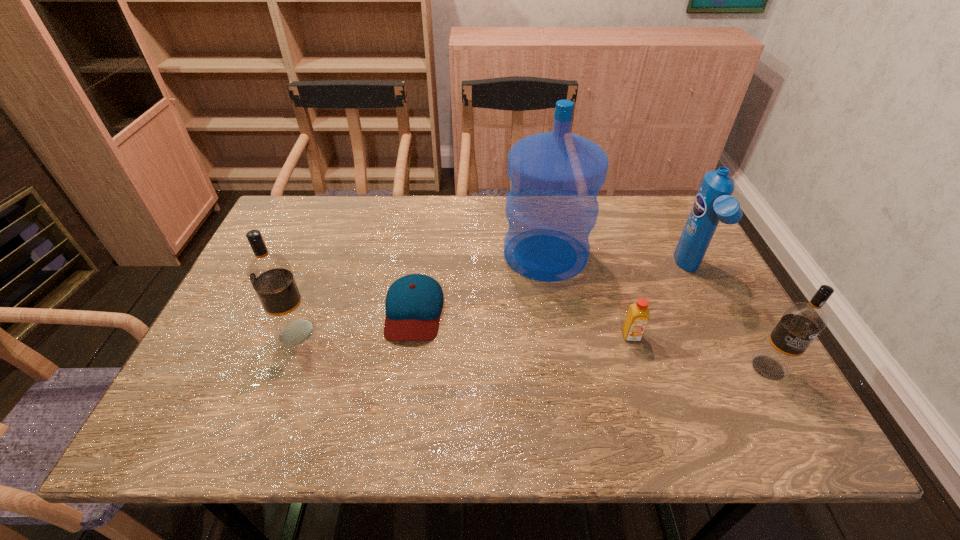
Locate an element on the screen. vodka that is at the right edge is located at coordinates (802, 322).

The height and width of the screenshot is (540, 960). Identify the location of shampoo that is at the right edge. (713, 203).

This screenshot has width=960, height=540. What are the coordinates of `object at the near right corner` in the screenshot? It's located at (802, 322).

In order to click on free space at the far edge of the desktop in this screenshot , I will do `click(607, 222)`.

In the image, there is a desktop. In order to click on vacant area at the near edge in this screenshot , I will do `click(553, 392)`.

Identify the location of free space at the left edge of the desktop. Image resolution: width=960 pixels, height=540 pixels. (307, 251).

In the image, there is a desktop. Find the location of `vacant space at the right edge`. vacant space at the right edge is located at coordinates (683, 281).

Locate an element on the screen. Image resolution: width=960 pixels, height=540 pixels. vacant space at the far left corner is located at coordinates (292, 198).

Locate an element on the screen. vacant area at the far right corner of the desktop is located at coordinates (665, 215).

The width and height of the screenshot is (960, 540). I want to click on empty space that is in between the shampoo and the fifth object from right to left, so click(552, 291).